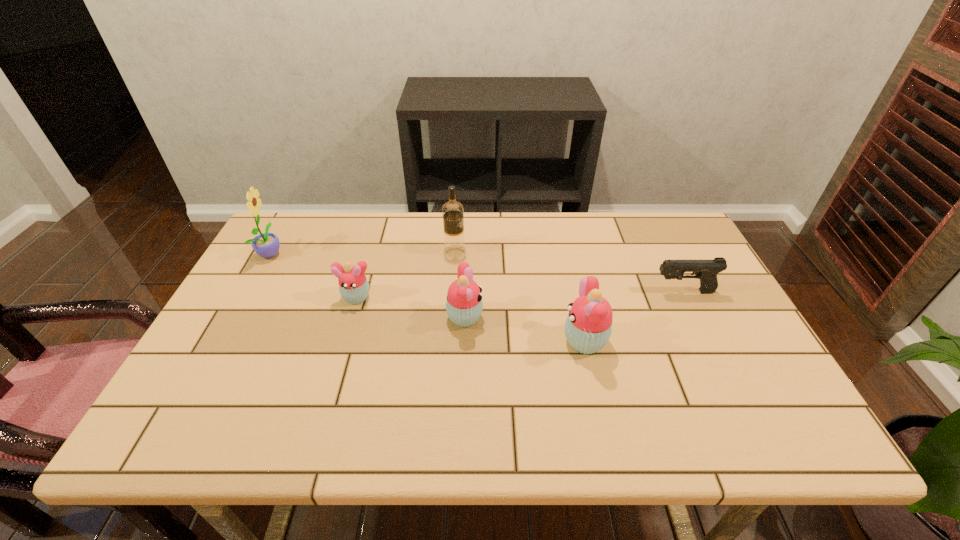
Please point a spot on the right to add another cupcake. Please provide its 2D coordinates. Your answer should be formatted as a tuple, i.e. [(x, y)], where the tuple contains the x and y coordinates of a point satisfying the conditions above.

[(718, 367)]